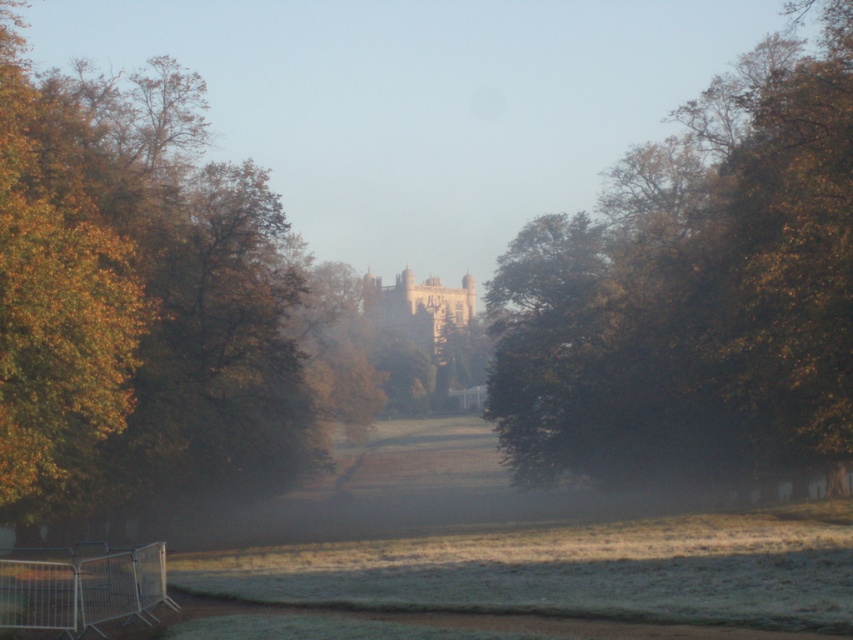
Which is more to the left, golden leafy tree at center or green leafy tree at center?

From the viewer's perspective, golden leafy tree at center appears more on the left side.

Is golden leafy tree at center taller than green leafy tree at center?

In fact, golden leafy tree at center may be shorter than green leafy tree at center.

Between point (113, 396) and point (848, 26), which one is positioned behind?

The point (848, 26) is behind.

Find the location of a particular element. The image size is (853, 640). golden leafy tree at center is located at coordinates (138, 305).